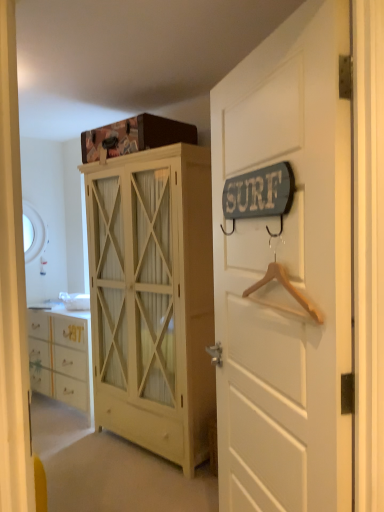
The image size is (384, 512). What do you see at coordinates (153, 298) in the screenshot? I see `matte yellow cabinet at center` at bounding box center [153, 298].

Identify the location of matte yellow cabinet at center. The height and width of the screenshot is (512, 384). (153, 298).

Considering the relative sizes of white wood door at upper right and wooden hanger at right in the image provided, is white wood door at upper right taller than wooden hanger at right?

Correct, white wood door at upper right is much taller as wooden hanger at right.

In the scene shown: Measure the distance from white wood door at upper right to wooden hanger at right.

white wood door at upper right and wooden hanger at right are 10.46 inches apart.

Who is bigger, white wood door at upper right or wooden hanger at right?

Bigger between the two is white wood door at upper right.

Is white wood door at upper right not near wooden hanger at right?

white wood door at upper right is actually quite close to wooden hanger at right.

The height and width of the screenshot is (512, 384). I want to click on hanger that is on the right side of matte yellow cabinet at center, so click(x=285, y=288).

Is wooden hanger at right at the right side of matte yellow cabinet at center?

Yes.

Are wooden hanger at right and matte yellow cabinet at center located far from each other?

wooden hanger at right is positioned a significant distance from matte yellow cabinet at center.

Considering the relative sizes of wooden hanger at right and matte yellow cabinet at center in the image provided, is wooden hanger at right smaller than matte yellow cabinet at center?

Indeed, wooden hanger at right has a smaller size compared to matte yellow cabinet at center.

Looking at this image, is matte yellow cabinet at center surrounding white wood door at upper right?

That's incorrect, white wood door at upper right is not inside matte yellow cabinet at center.

Is matte yellow cabinet at center in front of or behind white wood door at upper right in the image?

Visually, matte yellow cabinet at center is located behind white wood door at upper right.

From the image's perspective, is matte yellow cabinet at center below white wood door at upper right?

Correct, matte yellow cabinet at center appears lower than white wood door at upper right in the image.

Is matte yellow cabinet at center taller or shorter than white wood door at upper right?

In the image, matte yellow cabinet at center appears to be taller than white wood door at upper right.

Considering the relative sizes of white wood door at upper right and matte yellow cabinet at center in the image provided, is white wood door at upper right smaller than matte yellow cabinet at center?

Correct, white wood door at upper right occupies less space than matte yellow cabinet at center.

Based on the photo, is white wood door at upper right turned away from matte yellow cabinet at center?

No, white wood door at upper right is not facing the opposite direction of matte yellow cabinet at center.

Is white wood door at upper right placed right next to matte yellow cabinet at center?

There is a gap between white wood door at upper right and matte yellow cabinet at center.

Is white wood door at upper right wider or thinner than matte yellow cabinet at center?

In the image, white wood door at upper right appears to be more narrow than matte yellow cabinet at center.

Who is taller, wooden hanger at right or white wood door at upper right?

Standing taller between the two is white wood door at upper right.

Could you tell me if wooden hanger at right is facing white wood door at upper right?

Yes.

From a real-world perspective, who is located higher, wooden hanger at right or white wood door at upper right?

wooden hanger at right is physically above.

Does matte yellow cabinet at center turn towards wooden hanger at right?

No, matte yellow cabinet at center is not aimed at wooden hanger at right.

Considering the positions of objects matte yellow cabinet at center and wooden hanger at right in the image provided, who is more to the right, matte yellow cabinet at center or wooden hanger at right?

wooden hanger at right is more to the right.

Is matte yellow cabinet at center closer to the viewer compared to wooden hanger at right?

No, it is behind wooden hanger at right.

From a real-world perspective, is matte yellow cabinet at center positioned under wooden hanger at right based on gravity?

Indeed, from a real-world perspective, matte yellow cabinet at center is positioned beneath wooden hanger at right.

Locate an element on the screen. The width and height of the screenshot is (384, 512). door to the left of wooden hanger at right is located at coordinates (286, 273).

Where is `hanger located above the matte yellow cabinet at center (from the image's perspective)`? hanger located above the matte yellow cabinet at center (from the image's perspective) is located at coordinates (285, 288).

Considering their positions, is wooden hanger at right positioned closer to white wood door at upper right than matte yellow cabinet at center?

wooden hanger at right is closer to white wood door at upper right.

Looking at the image, which one is located further to white wood door at upper right, matte yellow cabinet at center or wooden hanger at right?

matte yellow cabinet at center is further to white wood door at upper right.

From the picture: Based on their spatial positions, is matte yellow cabinet at center or white wood door at upper right further from wooden hanger at right?

matte yellow cabinet at center.

From the image, which object appears to be farther from matte yellow cabinet at center, white wood door at upper right or wooden hanger at right?

wooden hanger at right is further to matte yellow cabinet at center.

Which object lies further to the anchor point wooden hanger at right, white wood door at upper right or matte yellow cabinet at center?

matte yellow cabinet at center.

When comparing their distances from matte yellow cabinet at center, does wooden hanger at right or white wood door at upper right seem closer?

Among the two, white wood door at upper right is located nearer to matte yellow cabinet at center.

Find the location of `hanger between white wood door at upper right and matte yellow cabinet at center along the z-axis`. hanger between white wood door at upper right and matte yellow cabinet at center along the z-axis is located at coordinates tap(285, 288).